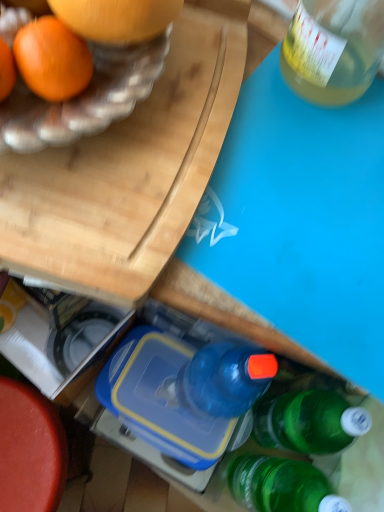
Question: From the image's perspective, relative to blue plastic lunch box at center, is smooth red table at lower left above or below?

Choices:
 (A) above
 (B) below

Answer: (B)

Question: Considering the positions of smooth red table at lower left and blue plastic lunch box at center in the image, is smooth red table at lower left taller or shorter than blue plastic lunch box at center?

Choices:
 (A) tall
 (B) short

Answer: (A)

Question: Which of these objects is positioned farthest from the smooth red table at lower left?

Choices:
 (A) wooden cutting board at upper left
 (B) blue plastic lunch box at center

Answer: (A)

Question: Estimate the real-world distances between objects in this image. Which object is closer to the smooth red table at lower left?

Choices:
 (A) wooden cutting board at upper left
 (B) blue plastic lunch box at center

Answer: (B)